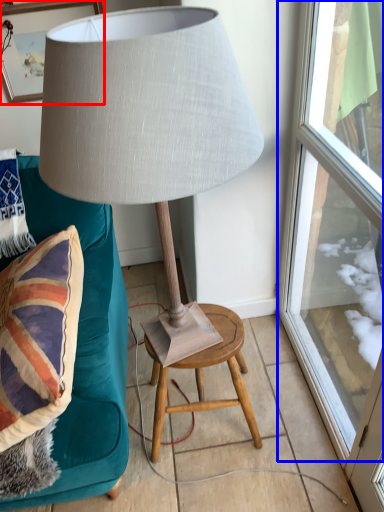
Question: Which object appears closest to the camera in this image, picture frame (highlighted by a red box) or window (highlighted by a blue box)?

Choices:
 (A) picture frame
 (B) window

Answer: (B)